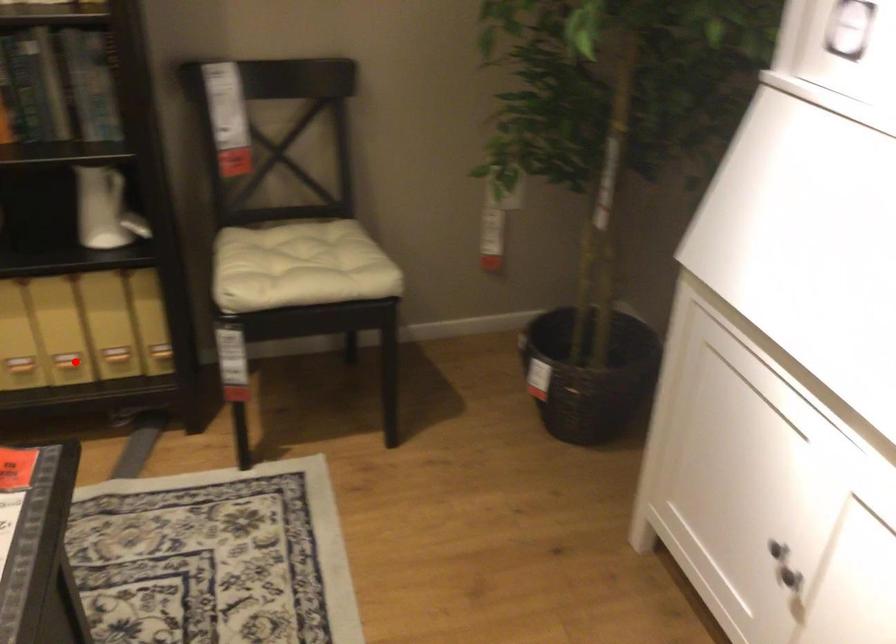
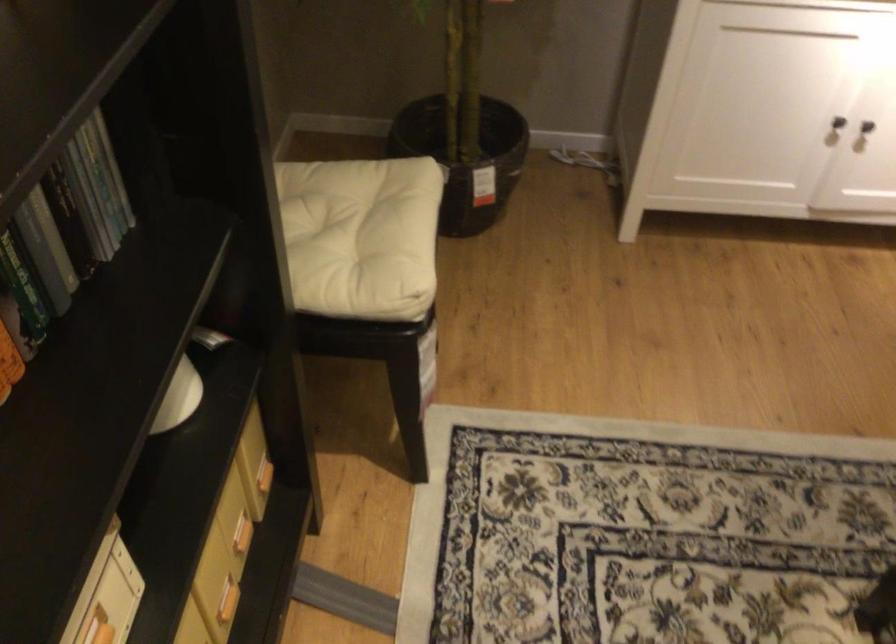
In the second image, find the point that corresponds to the highlighted location in the first image.

(227, 601)